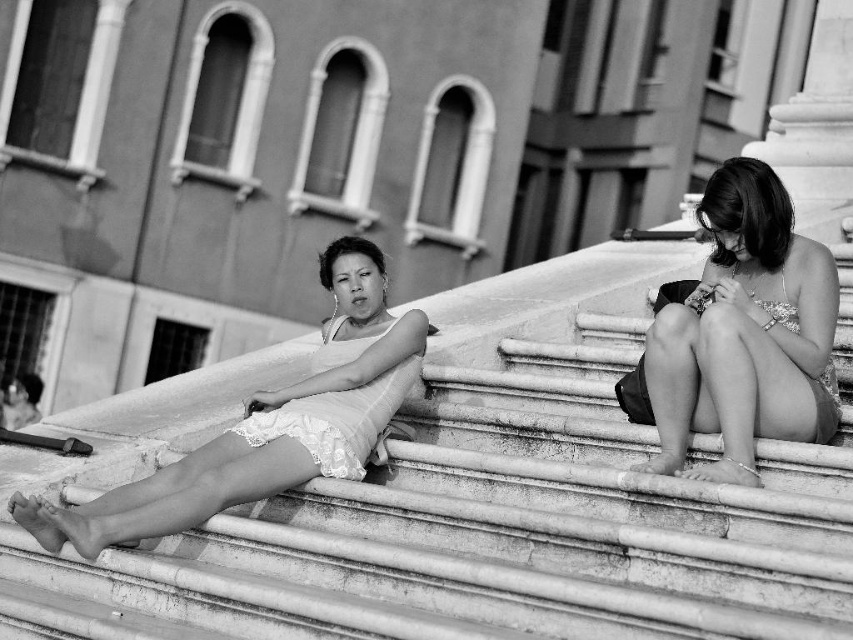
Question: Can you confirm if matte silver dress at right is bigger than lace fabric dress at center?

Choices:
 (A) yes
 (B) no

Answer: (B)

Question: Which point is closer to the camera taking this photo?

Choices:
 (A) (370, 410)
 (B) (419, 602)

Answer: (B)

Question: Which object is the closest to the lace fabric dress at center?

Choices:
 (A) smooth stone stairs at center
 (B) matte silver dress at right

Answer: (A)

Question: Which point is closer to the camera?

Choices:
 (A) (653, 420)
 (B) (560, 460)

Answer: (A)

Question: Considering the relative positions of matte silver dress at right and lace fabric dress at center in the image provided, where is matte silver dress at right located with respect to lace fabric dress at center?

Choices:
 (A) above
 (B) below

Answer: (A)

Question: Does smooth stone stairs at center appear under lace fabric dress at center?

Choices:
 (A) no
 (B) yes

Answer: (B)